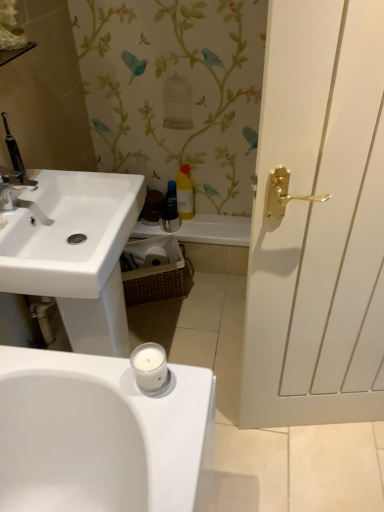
Find the location of a particular element. The image size is (384, 512). free region on the left part of white wood door at right is located at coordinates (237, 431).